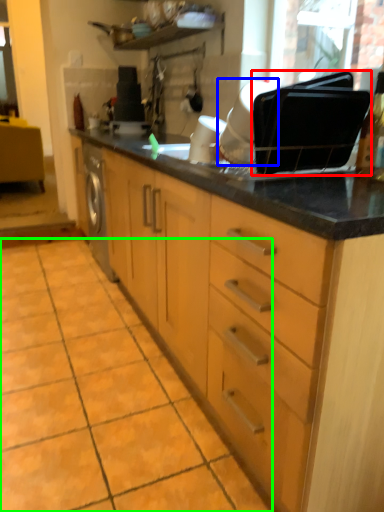
Question: Considering the real-world distances, which object is closest to appliance (highlighted by a red box)? appliance (highlighted by a blue box) or ceramic tile (highlighted by a green box).

Choices:
 (A) appliance
 (B) ceramic tile

Answer: (A)